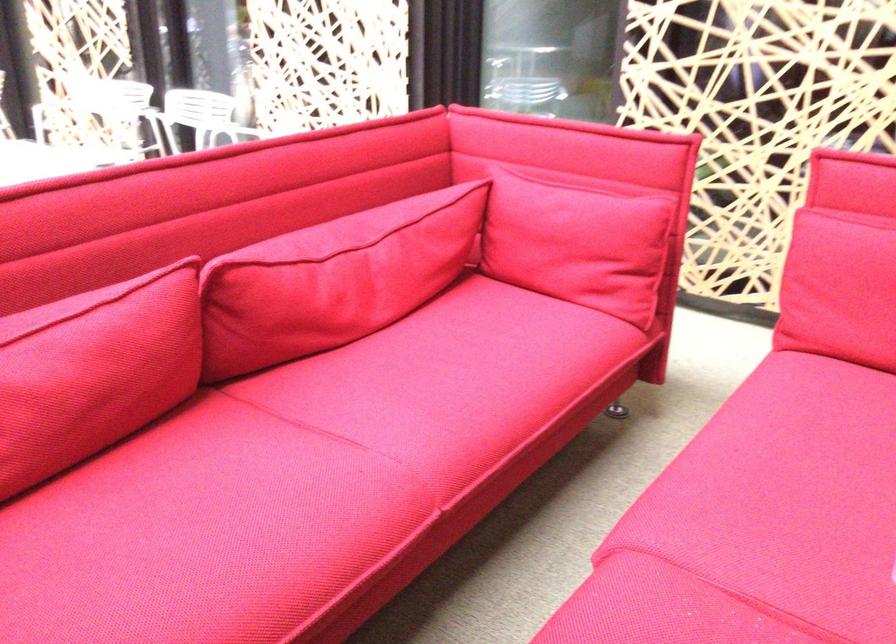
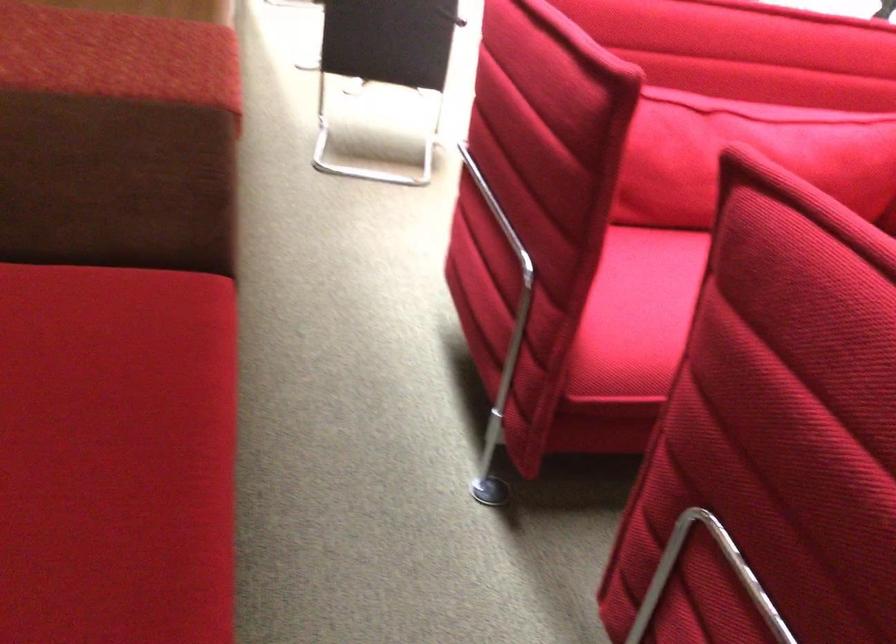
Question: The images are taken continuously from a first-person perspective. In which direction is your viewpoint rotating?

Choices:
 (A) Left
 (B) Right
 (C) Up
 (D) Down

Answer: (A)